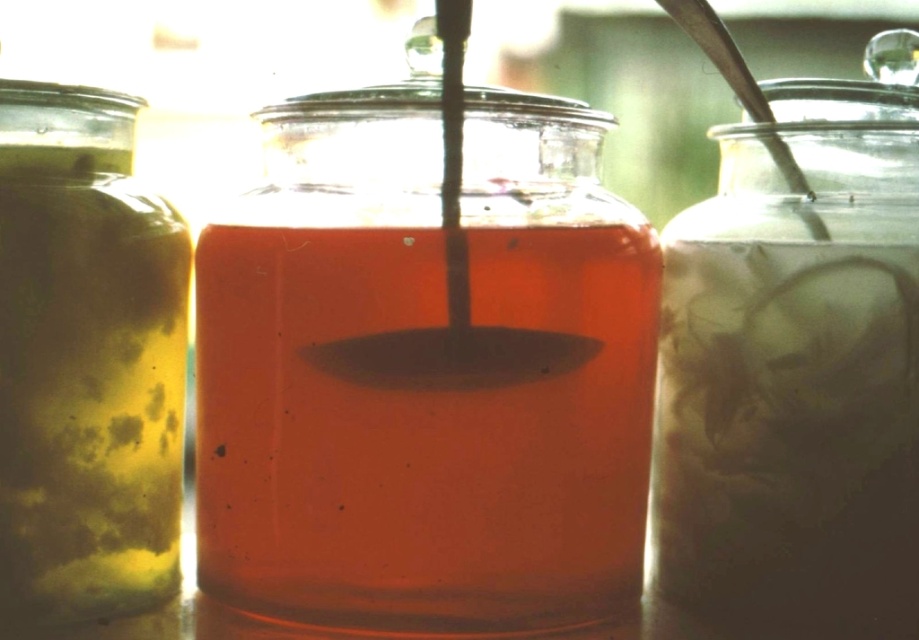
Is translucent glass jar at center above matte yellow glass jar at left?

Yes, translucent glass jar at center is above matte yellow glass jar at left.

Can you confirm if translucent glass jar at center is taller than matte yellow glass jar at left?

Yes, translucent glass jar at center is taller than matte yellow glass jar at left.

Locate an element on the screen. The height and width of the screenshot is (640, 919). translucent glass jar at center is located at coordinates click(x=425, y=368).

Locate an element on the screen. Image resolution: width=919 pixels, height=640 pixels. translucent glass jar at right is located at coordinates (796, 368).

Can you confirm if translucent glass jar at right is positioned to the left of matte yellow glass jar at left?

In fact, translucent glass jar at right is to the right of matte yellow glass jar at left.

Does point (841, 104) come farther from viewer compared to point (123, 460)?

Yes, point (841, 104) is behind point (123, 460).

Where is `translucent glass jar at right`? This screenshot has height=640, width=919. translucent glass jar at right is located at coordinates (796, 368).

In the scene shown: Which is above, translucent glass jar at center or translucent glass jar at right?

translucent glass jar at center is above.

Who is lower down, translucent glass jar at center or translucent glass jar at right?

Positioned lower is translucent glass jar at right.

What do you see at coordinates (425, 368) in the screenshot? I see `translucent glass jar at center` at bounding box center [425, 368].

Find the location of a particular element. translucent glass jar at center is located at coordinates (425, 368).